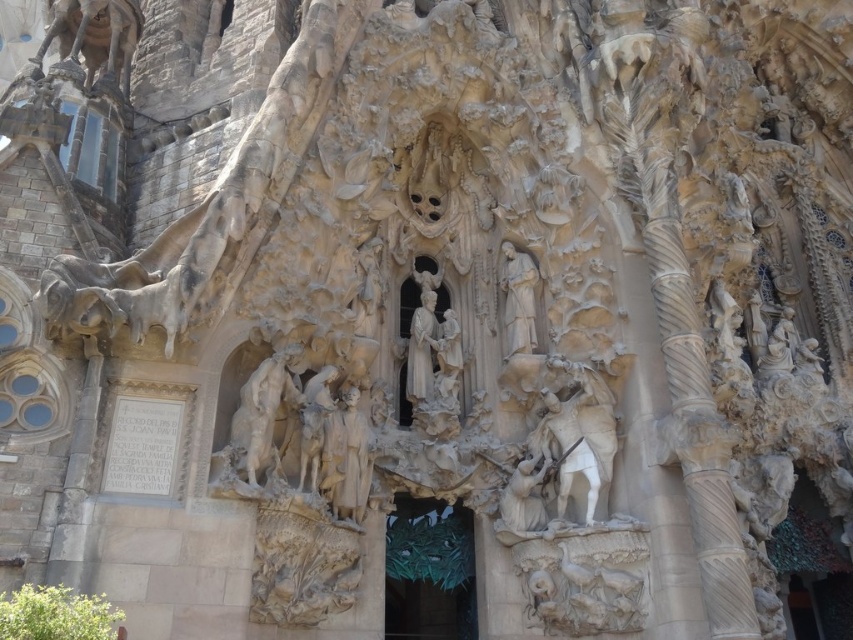
Which is behind, point (277, 355) or point (514, 273)?

The point (514, 273) is more distant.

Does white stone horse at center come in front of white stone statue at center-right?

Yes, white stone horse at center is in front of white stone statue at center-right.

Does point (277, 376) come closer to viewer compared to point (529, 305)?

Yes, it is.

This screenshot has height=640, width=853. What are the coordinates of `white stone horse at center` in the screenshot? It's located at (262, 413).

Is white marble horse at right smaller than white stone statue at center-right?

Actually, white marble horse at right might be larger than white stone statue at center-right.

Does white marble horse at right appear under white stone statue at center-right?

Yes.

This screenshot has height=640, width=853. What do you see at coordinates (577, 442) in the screenshot? I see `white marble horse at right` at bounding box center [577, 442].

You are a GUI agent. You are given a task and a screenshot of the screen. Output one action in this format:
    pyautogui.click(x=<x>, y=<y>)
    Task: Click on the white marble horse at right
    Image resolution: width=853 pixels, height=640 pixels.
    Given the screenshot: What is the action you would take?
    pyautogui.click(x=577, y=442)

Which is more to the right, white stone statue at center or white stone statue at center-right?

Positioned to the right is white stone statue at center-right.

Between white stone statue at center and white stone statue at center-right, which one appears on the left side from the viewer's perspective?

white stone statue at center is more to the left.

Which is in front, point (328, 454) or point (537, 276)?

Positioned in front is point (328, 454).

Locate an element on the screen. This screenshot has height=640, width=853. white stone statue at center is located at coordinates 346,458.